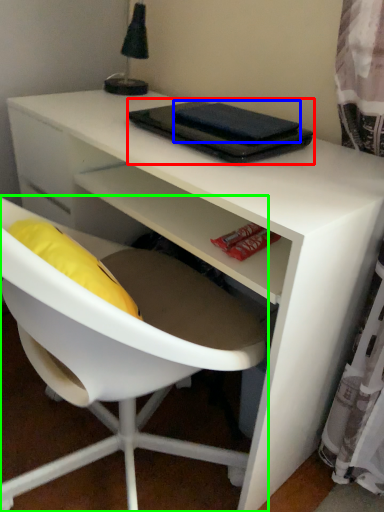
Question: Which object is the closest to the notebook (highlighted by a red box)? Choose among these: notebook (highlighted by a blue box) or chair (highlighted by a green box).

Choices:
 (A) notebook
 (B) chair

Answer: (A)